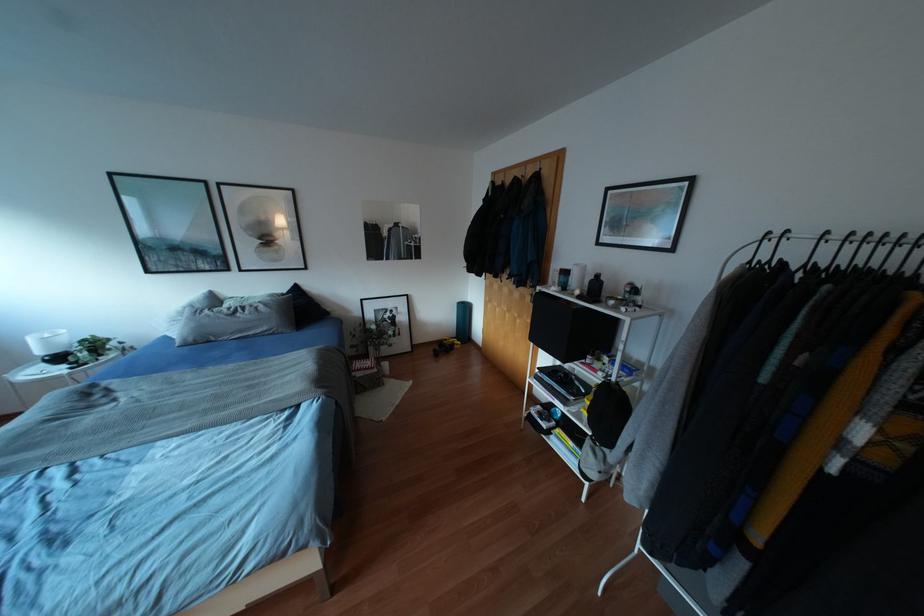
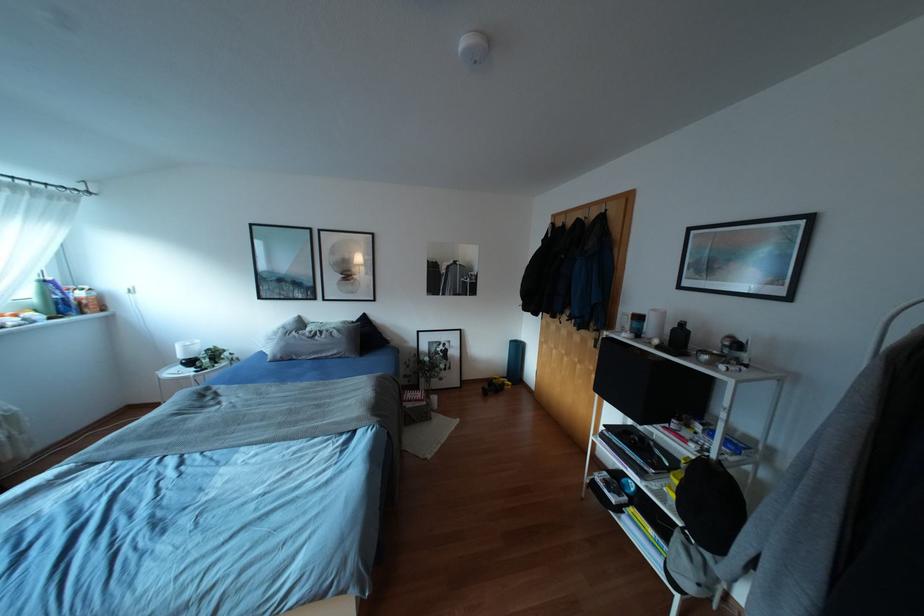
Where in the second image is the point corresponding to [544,172] from the first image?

(612, 214)